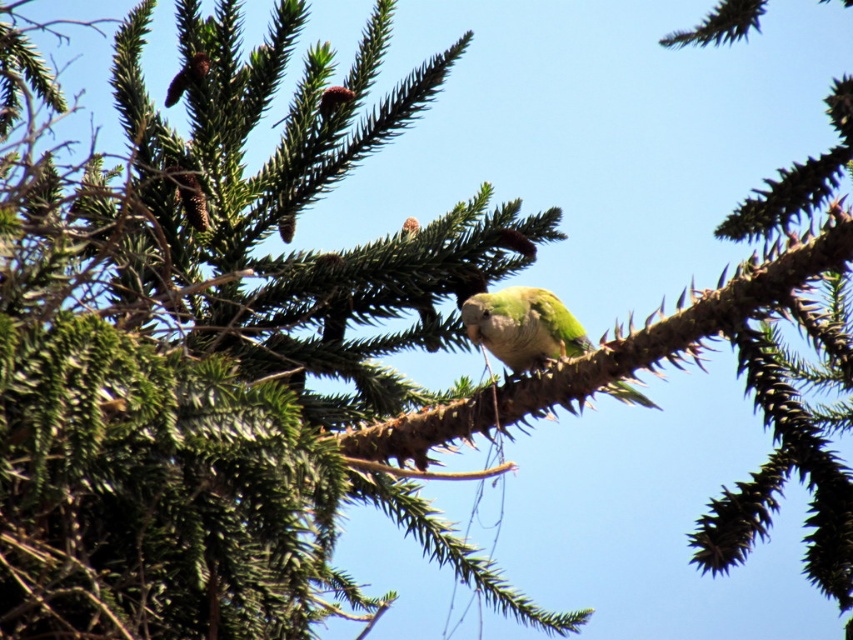
Describe the element at coordinates (606, 355) in the screenshot. I see `green textured branch at center` at that location.

Based on the photo, does green textured branch at center have a greater height compared to green feathered parrot at upper left?

Indeed, green textured branch at center has a greater height compared to green feathered parrot at upper left.

Which is in front, point (589, 378) or point (187, 81)?

Point (589, 378) is in front.

The height and width of the screenshot is (640, 853). Find the location of `green textured branch at center`. green textured branch at center is located at coordinates [606, 355].

Is green textured branch at center wider than green matte parrot at center?

Indeed, green textured branch at center has a greater width compared to green matte parrot at center.

Measure the distance from green textured branch at center to green matte parrot at center.

green textured branch at center is 6.81 inches from green matte parrot at center.

Does point (793, 275) lie behind point (512, 292)?

No.

You are a GUI agent. You are given a task and a screenshot of the screen. Output one action in this format:
    pyautogui.click(x=<x>, y=<y>)
    Task: Click on the green textured branch at center
    
    Given the screenshot: What is the action you would take?
    pyautogui.click(x=606, y=355)

Can you confirm if green matte parrot at center is positioned to the left of green feathered parrot at upper left?

No, green matte parrot at center is not to the left of green feathered parrot at upper left.

Does green matte parrot at center have a lesser height compared to green feathered parrot at upper left?

No.

Is point (537, 296) positioned in front of point (184, 72)?

Yes, it is in front of point (184, 72).

You are a GUI agent. You are given a task and a screenshot of the screen. Output one action in this format:
    pyautogui.click(x=<x>, y=<y>)
    Task: Click on the green matte parrot at center
    The image size is (853, 640).
    Given the screenshot: What is the action you would take?
    pyautogui.click(x=523, y=326)